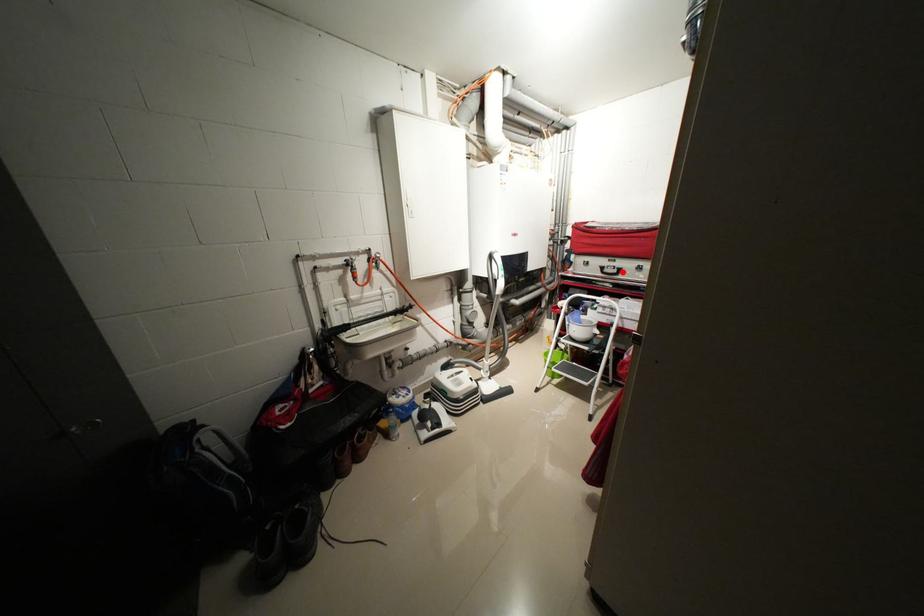
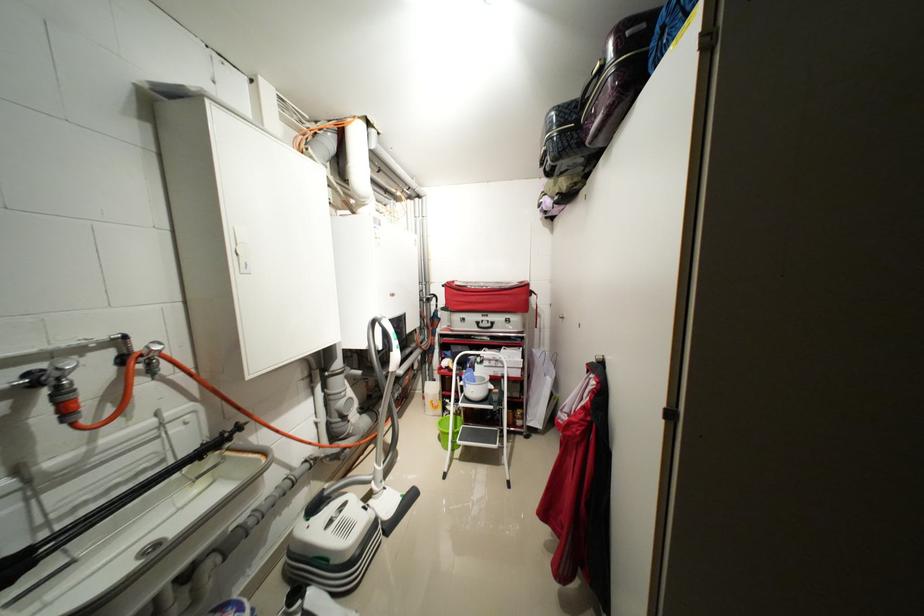
Question: I am providing you with two images of the same scene from different viewpoints. A red point is marked on the first image. At the location where the point appears in image 1, is it still visible in image 2?

Choices:
 (A) Yes
 (B) No

Answer: (A)